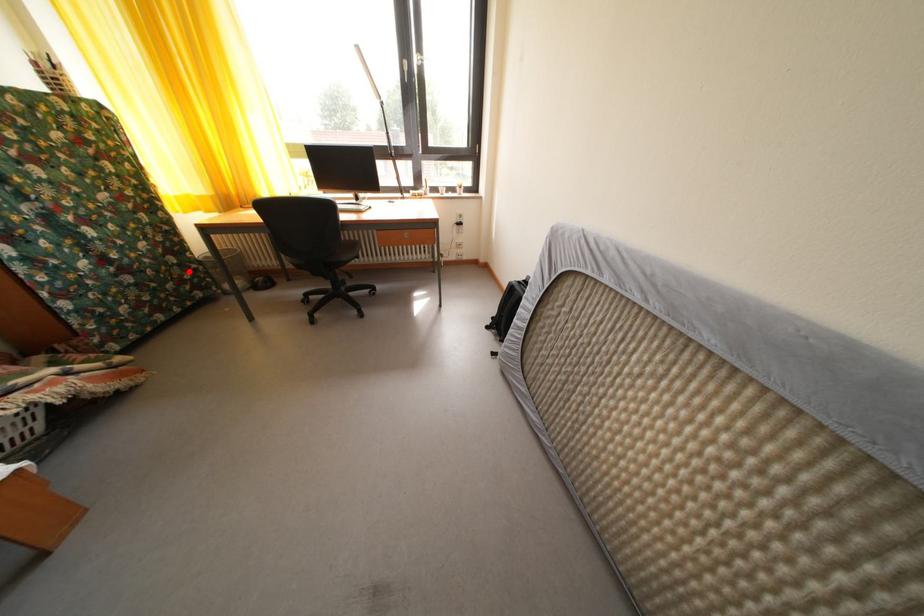
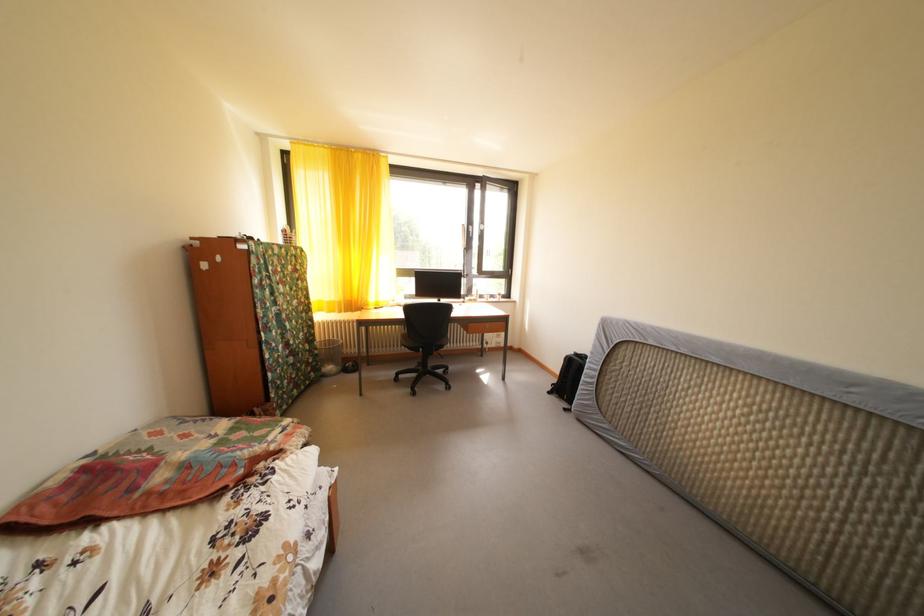
Where in the second image is the point corresponding to the highlighted location from the first image?

(320, 357)